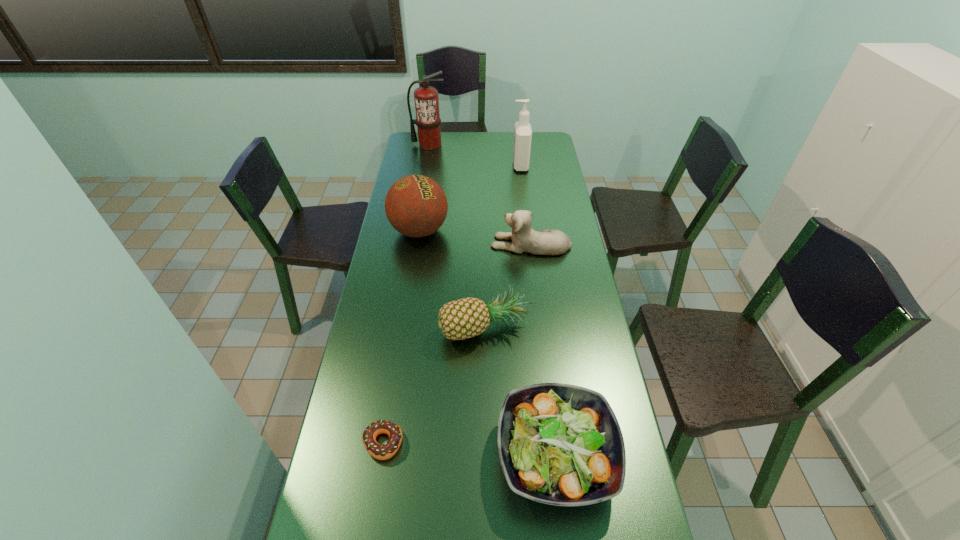
What are the coordinates of `vacant space located on the front label of the sixth nearest object` in the screenshot? It's located at (430, 165).

Locate an element on the screen. This screenshot has width=960, height=540. vacant space located on the front label of the sixth nearest object is located at coordinates (497, 165).

Locate an element on the screen. free space located on the right of the basketball is located at coordinates [529, 231].

What are the coordinates of `vacant space located on the front-facing side of the puppy` in the screenshot? It's located at (423, 244).

Locate an element on the screen. This screenshot has width=960, height=540. free location located 0.360m on the front-facing side of the puppy is located at coordinates (398, 244).

Locate an element on the screen. Image resolution: width=960 pixels, height=540 pixels. free location located on the front-facing side of the puppy is located at coordinates (419, 244).

Where is `vacant space situated on the front of the fifth farthest object`? vacant space situated on the front of the fifth farthest object is located at coordinates 486,382.

At what (x,y) coordinates should I click in order to perform the action: click on vacant space located 0.290m on the back of the salad plate. Please return your answer as a coordinate pair (x, y). The image size is (960, 540). Looking at the image, I should click on (540, 321).

The image size is (960, 540). Identify the location of free location located on the back of the shortest object. (401, 326).

The width and height of the screenshot is (960, 540). What are the coordinates of `object that is at the far edge` in the screenshot? It's located at (428, 121).